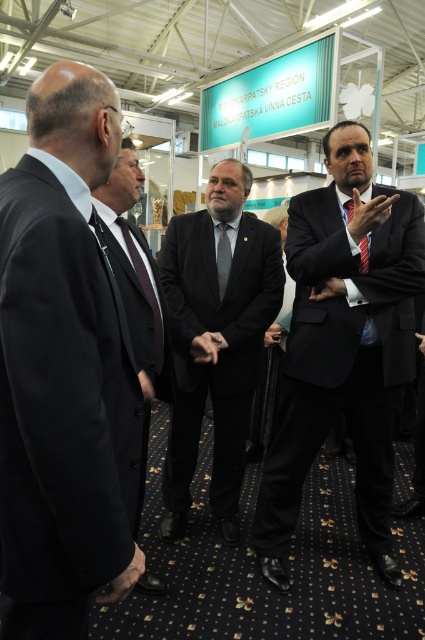
Does black silk tie at center come behind red silk tie at right?

No.

Between point (138, 275) and point (365, 266), which one is positioned in front?

Point (138, 275)

Is point (155, 360) closer to camera compared to point (348, 220)?

Yes, point (155, 360) is closer to viewer.

Locate an element on the screen. This screenshot has width=425, height=640. black silk tie at center is located at coordinates (x=144, y=291).

Which of these two, black suit at center or black silk tie at center, stands shorter?

black silk tie at center

From the picture: Who is more forward, (153, 352) or (121, 227)?

Point (153, 352) is in front.

Who is more distant from viewer, [133,330] or [132,253]?

Positioned behind is point [132,253].

Identify the location of black suit at center. (136, 272).

Does point (300, 243) come behind point (175, 244)?

No, (300, 243) is closer to viewer.

Image resolution: width=425 pixels, height=640 pixels. Describe the element at coordinates (342, 346) in the screenshot. I see `black velvet suit at center` at that location.

Identify the location of black velvet suit at center. This screenshot has width=425, height=640. (342, 346).

Locate an element on the screen. black velvet suit at center is located at coordinates [x=342, y=346].